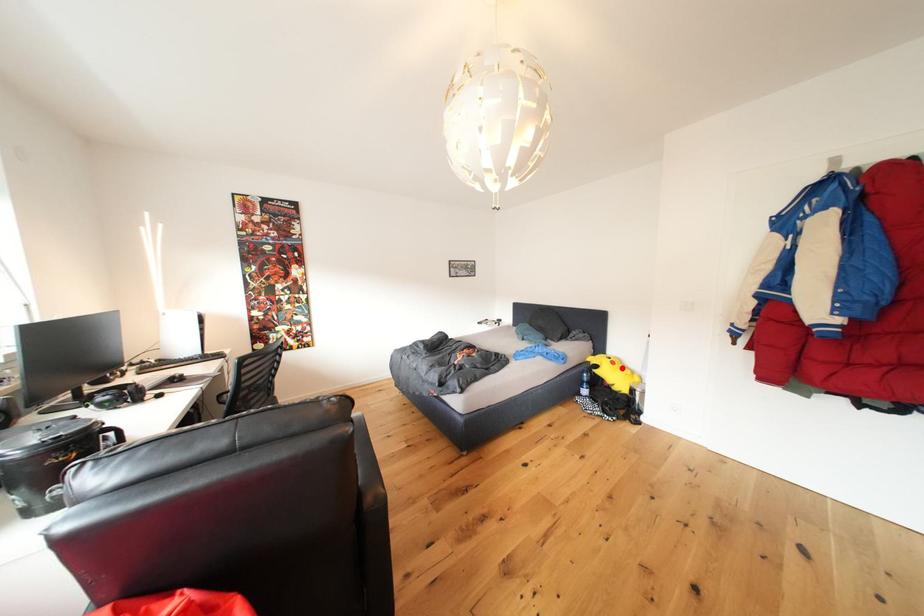
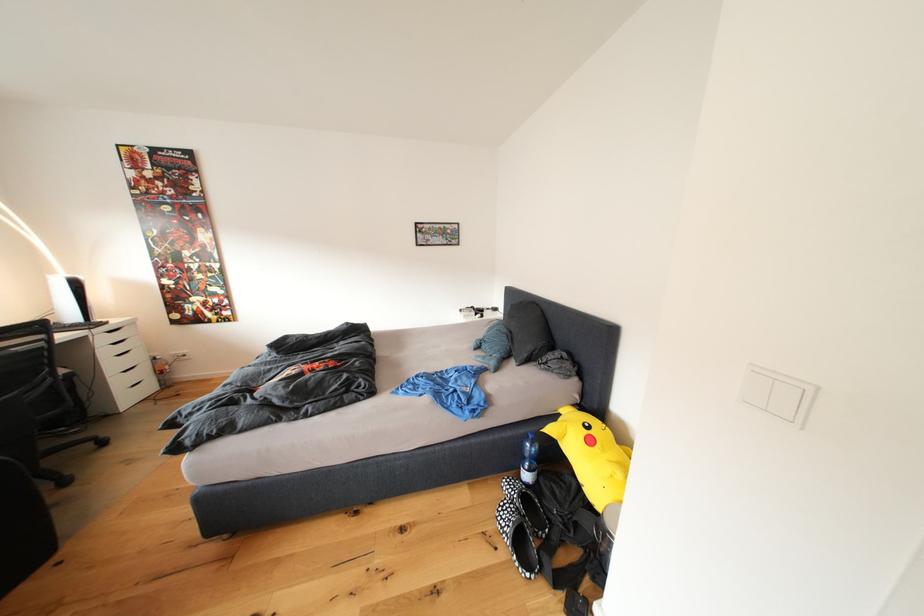
Question: I am providing you with two images of the same scene from different viewpoints. A red point is marked on the first image. Is the red point's position out of view in image 2?

Choices:
 (A) Yes
 (B) No

Answer: (B)